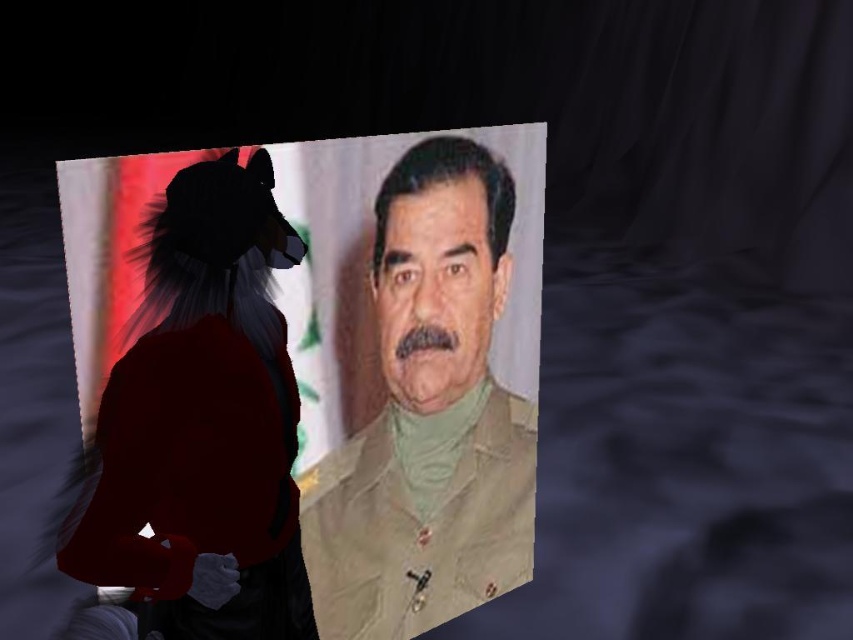
Question: Which point is farther from the camera taking this photo?

Choices:
 (A) (447, 252)
 (B) (282, 364)
 (C) (451, 344)

Answer: (C)

Question: Is beige matte uniform at center below beige uniform at center?

Choices:
 (A) yes
 (B) no

Answer: (A)

Question: Which of the following is the farthest from the observer?

Choices:
 (A) beige matte uniform at center
 (B) beige matte face at center

Answer: (B)

Question: Does beige matte uniform at center appear over beige uniform at center?

Choices:
 (A) yes
 (B) no

Answer: (B)

Question: Which point appears closest to the camera in this image?

Choices:
 (A) (440, 388)
 (B) (402, 180)
 (C) (480, 396)

Answer: (B)

Question: Is beige matte uniform at center bigger than beige matte face at center?

Choices:
 (A) no
 (B) yes

Answer: (B)